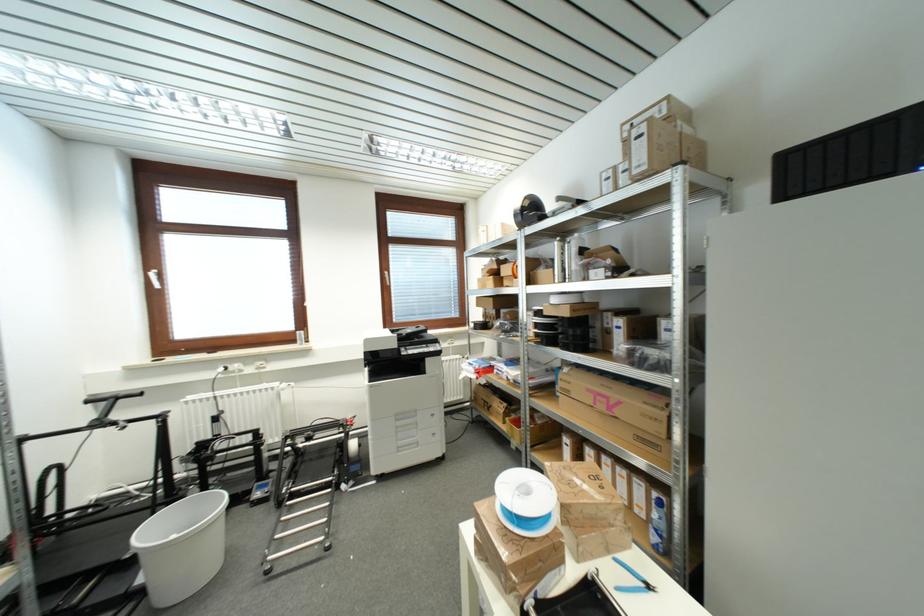
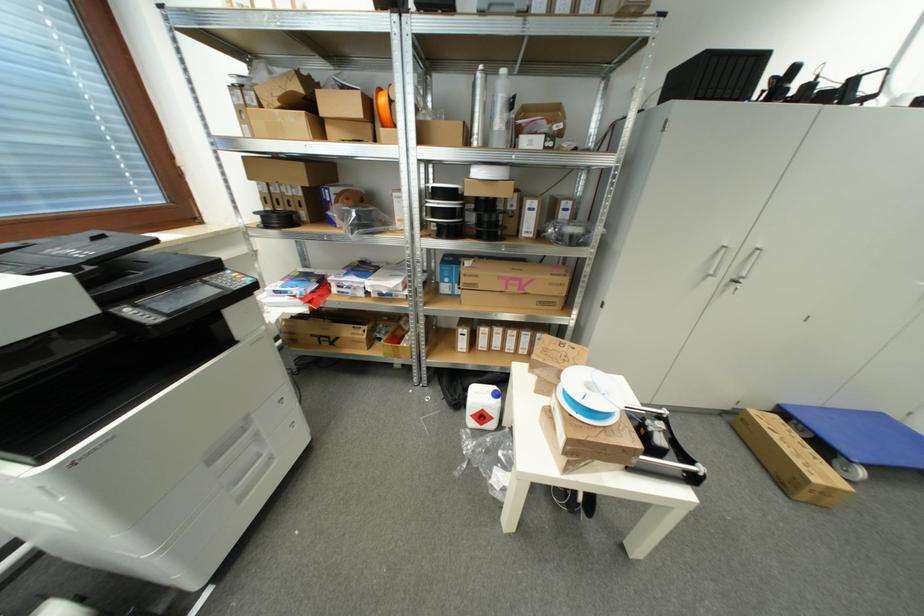
Where in the second image is the point corresponding to (x=578, y=268) from the first image?

(504, 126)